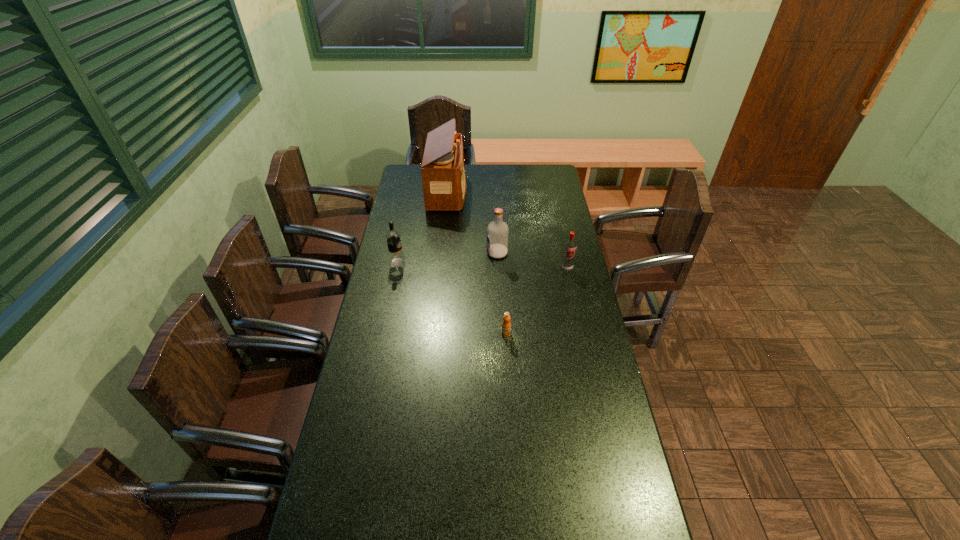
Locate an element on the screen. free point located on the label of the second vodka from right to left is located at coordinates (393, 253).

Identify the location of vacant space located 0.240m on the label of the second vodka from right to left. (430, 253).

The width and height of the screenshot is (960, 540). What are the coordinates of `free space located on the label of the leftmost vodka` in the screenshot? It's located at coord(501,263).

In order to click on vacant space located 0.300m on the front label of the fourth tallest object in this screenshot , I will do `click(580, 329)`.

Locate an element on the screen. This screenshot has height=540, width=960. free space located 0.180m on the front label of the orange juice is located at coordinates (509, 381).

In order to click on object that is at the far edge in this screenshot , I will do `click(443, 170)`.

Where is `radio receiver present at the left edge`? The width and height of the screenshot is (960, 540). radio receiver present at the left edge is located at coordinates (443, 170).

Where is `vodka present at the left edge`? The image size is (960, 540). vodka present at the left edge is located at coordinates (396, 258).

Locate an element on the screen. This screenshot has width=960, height=540. object that is positioned at the right edge is located at coordinates (570, 245).

You are a GUI agent. You are given a task and a screenshot of the screen. Output one action in this format:
    pyautogui.click(x=<x>, y=<y>)
    Task: Click on the object positioned at the far left corner
    
    Given the screenshot: What is the action you would take?
    pyautogui.click(x=443, y=170)